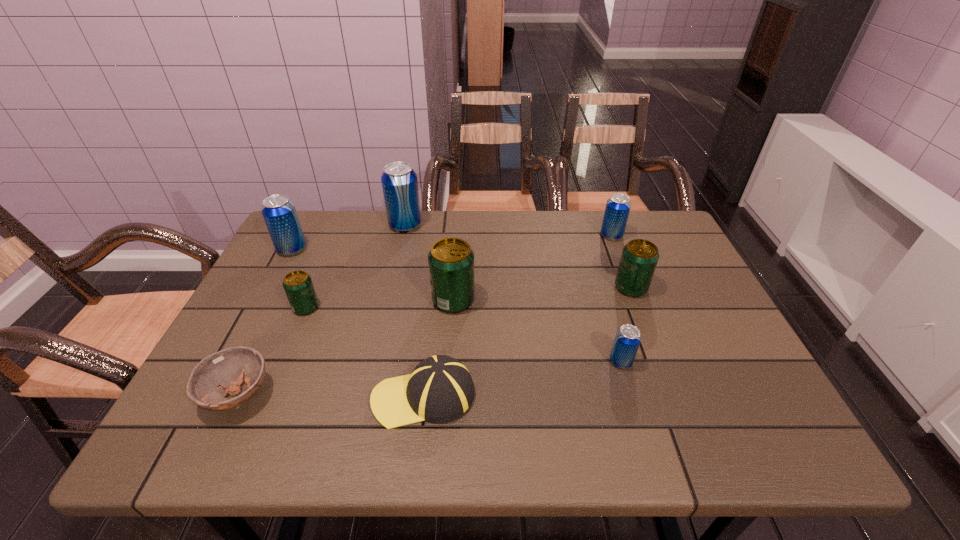
Where is `the leftmost green beer can`? The width and height of the screenshot is (960, 540). the leftmost green beer can is located at coordinates (298, 286).

The image size is (960, 540). In order to click on the sixth beer can from right to left in this screenshot , I will do `click(298, 286)`.

In order to click on black baseball cap in this screenshot , I will do `click(440, 388)`.

You are a GUI agent. You are given a task and a screenshot of the screen. Output one action in this format:
    pyautogui.click(x=<x>, y=<y>)
    Task: Click on the bowl
    The image size is (960, 540).
    Given the screenshot: What is the action you would take?
    pyautogui.click(x=221, y=373)

Image resolution: width=960 pixels, height=540 pixels. What are the coordinates of `brown bowl` in the screenshot? It's located at (221, 373).

The height and width of the screenshot is (540, 960). Find the location of `vacant space located 0.060m on the left of the second blue beer can from left to right`. vacant space located 0.060m on the left of the second blue beer can from left to right is located at coordinates (370, 225).

Where is `free space located 0.340m on the front of the leftmost blue beer can`? free space located 0.340m on the front of the leftmost blue beer can is located at coordinates (238, 350).

What are the coordinates of `free space located on the back of the fourth beer can from right to left` in the screenshot? It's located at (456, 267).

Identify the location of blank space located 0.060m on the back of the second smallest blue beer can. The height and width of the screenshot is (540, 960). (605, 219).

Locate an element on the screen. The image size is (960, 540). vacant position located on the back of the rightmost green beer can is located at coordinates (604, 218).